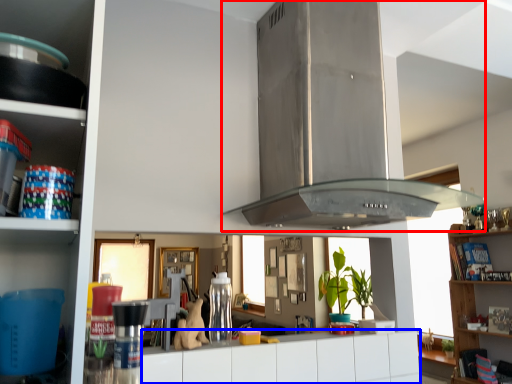
Question: Which object appears closest to the camera in this image, exhaust hood (highlighted by a red box) or drawer (highlighted by a blue box)?

Choices:
 (A) exhaust hood
 (B) drawer

Answer: (A)